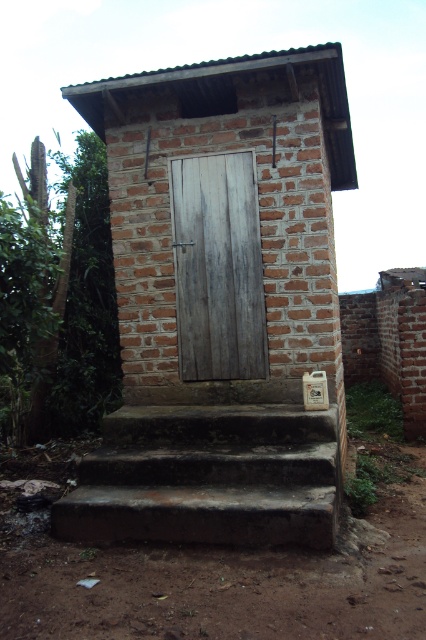
Between point (311, 228) and point (227, 365), which one is positioned in front?

Point (311, 228) is more forward.

The height and width of the screenshot is (640, 426). Find the location of `brick/rough wooden door at center`. brick/rough wooden door at center is located at coordinates (221, 301).

The width and height of the screenshot is (426, 640). I want to click on brick/rough wooden door at center, so click(221, 301).

Between point (132, 465) and point (201, 310), which one is positioned in front?

Point (132, 465) is in front.

Can you confirm if dark brown concrete stairs at center is positioned below weathered wood door at center?

Correct, dark brown concrete stairs at center is located below weathered wood door at center.

Who is more forward, (x=271, y=499) or (x=198, y=323)?

Point (x=271, y=499) is more forward.

Locate an element on the screen. Image resolution: width=426 pixels, height=640 pixels. dark brown concrete stairs at center is located at coordinates (207, 477).

Is the position of brick/rough wooden door at center less distant than that of dark brown concrete stairs at center?

No, brick/rough wooden door at center is further to the viewer.

This screenshot has width=426, height=640. Describe the element at coordinates (221, 301) in the screenshot. I see `brick/rough wooden door at center` at that location.

I want to click on brick/rough wooden door at center, so click(x=221, y=301).

I want to click on brick/rough wooden door at center, so click(x=221, y=301).